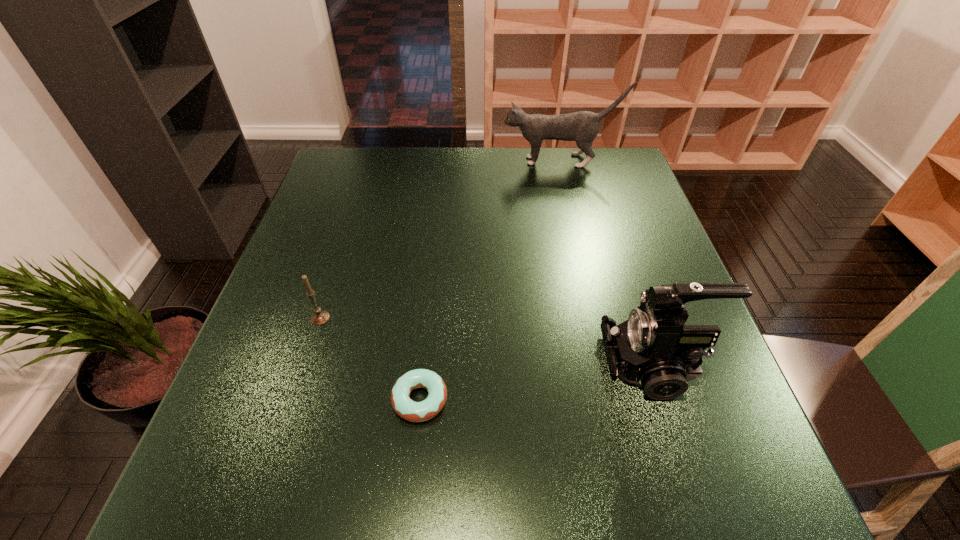
Locate an element on the screen. blank area at the near edge is located at coordinates (657, 477).

In the image, there is a desktop. At what (x,y) coordinates should I click in order to perform the action: click on free space at the left edge. Please return your answer as a coordinate pair (x, y). This screenshot has width=960, height=540. Looking at the image, I should click on (324, 193).

The width and height of the screenshot is (960, 540). What are the coordinates of `vacant space at the right edge of the desktop` in the screenshot? It's located at (674, 424).

This screenshot has height=540, width=960. In order to click on free region at the near left corner in this screenshot , I will do `click(192, 476)`.

Where is `free space at the far right corner of the desktop`? The width and height of the screenshot is (960, 540). free space at the far right corner of the desktop is located at coordinates (580, 160).

Image resolution: width=960 pixels, height=540 pixels. I want to click on free spot at the near right corner of the desktop, so click(678, 483).

Locate an element on the screen. empty space between the candle and the shortest object is located at coordinates (371, 359).

Find the location of a particular element. The width and height of the screenshot is (960, 540). vacant area between the doughnut and the third nearest object is located at coordinates (371, 359).

Identify the location of free spot between the shortest object and the camcorder. (537, 381).

Image resolution: width=960 pixels, height=540 pixels. I want to click on free space between the camcorder and the leftmost object, so click(x=487, y=341).